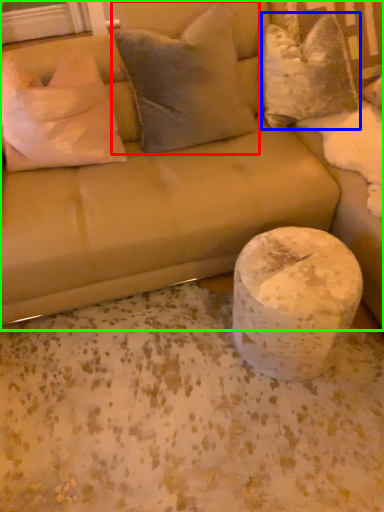
Question: Which object is the closest to the pillow (highlighted by a red box)? Choose among these: pillow (highlighted by a blue box) or studio couch (highlighted by a green box).

Choices:
 (A) pillow
 (B) studio couch

Answer: (B)